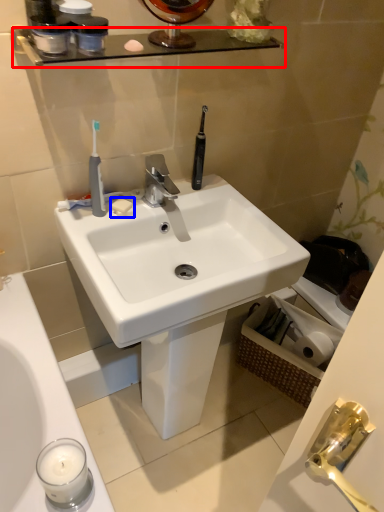
Question: Which of the following is the farthest to the observer, balustrade (highlighted by a red box) or soap (highlighted by a blue box)?

Choices:
 (A) balustrade
 (B) soap

Answer: (B)